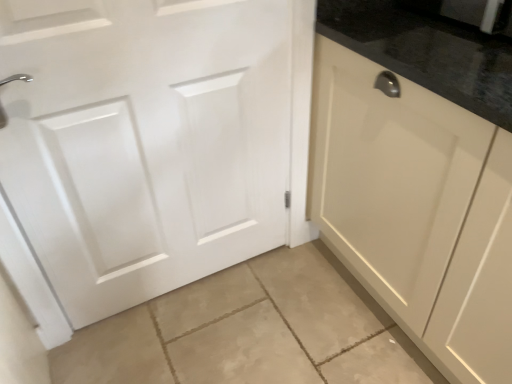
Question: Should I look upward or downward to see white matte door at left?

Choices:
 (A) down
 (B) up

Answer: (B)

Question: Is white matte door at left to the right of matte cream cabinet at right from the viewer's perspective?

Choices:
 (A) no
 (B) yes

Answer: (A)

Question: Can you confirm if white matte door at left is thinner than matte cream cabinet at right?

Choices:
 (A) no
 (B) yes

Answer: (B)

Question: From a real-world perspective, is white matte door at left physically below matte cream cabinet at right?

Choices:
 (A) yes
 (B) no

Answer: (B)

Question: Can you confirm if white matte door at left is positioned to the left of matte cream cabinet at right?

Choices:
 (A) yes
 (B) no

Answer: (A)

Question: Are white matte door at left and matte cream cabinet at right located far from each other?

Choices:
 (A) no
 (B) yes

Answer: (A)

Question: Is white matte door at left in front of matte cream cabinet at right?

Choices:
 (A) no
 (B) yes

Answer: (A)

Question: From the image's perspective, is matte cream cabinet at right on white matte door at left?

Choices:
 (A) yes
 (B) no

Answer: (B)

Question: Is white matte door at left completely or partially inside matte cream cabinet at right?

Choices:
 (A) no
 (B) yes

Answer: (A)

Question: Is matte cream cabinet at right further to the viewer compared to white matte door at left?

Choices:
 (A) no
 (B) yes

Answer: (A)

Question: Considering the relative sizes of matte cream cabinet at right and white matte door at left in the image provided, is matte cream cabinet at right smaller than white matte door at left?

Choices:
 (A) yes
 (B) no

Answer: (B)

Question: Considering the relative sizes of matte cream cabinet at right and white matte door at left in the image provided, is matte cream cabinet at right wider than white matte door at left?

Choices:
 (A) no
 (B) yes

Answer: (B)

Question: Does matte cream cabinet at right have a larger size compared to white matte door at left?

Choices:
 (A) no
 (B) yes

Answer: (B)

Question: Visually, is white matte door at left positioned to the left or to the right of matte cream cabinet at right?

Choices:
 (A) left
 (B) right

Answer: (A)